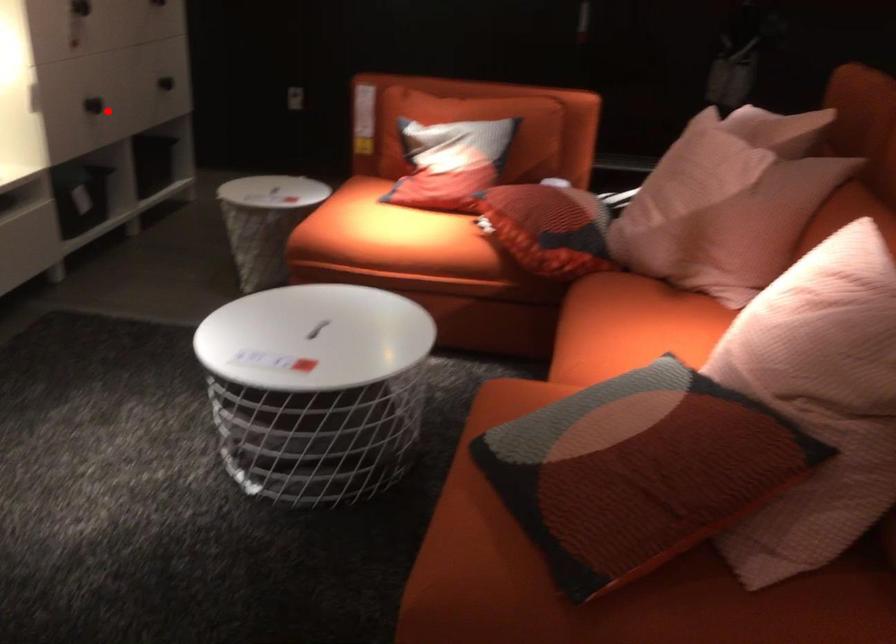
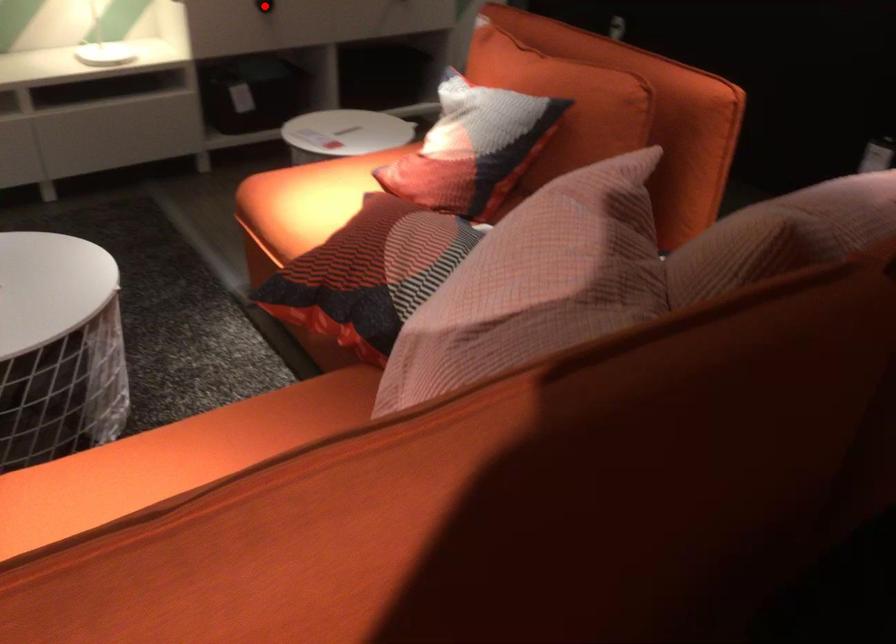
I am providing you with two images of the same scene from different viewpoints. A red point is marked on the first image and another point is marked on the second image. Does the point marked in image1 correspond to the same location as the one in image2?

Yes